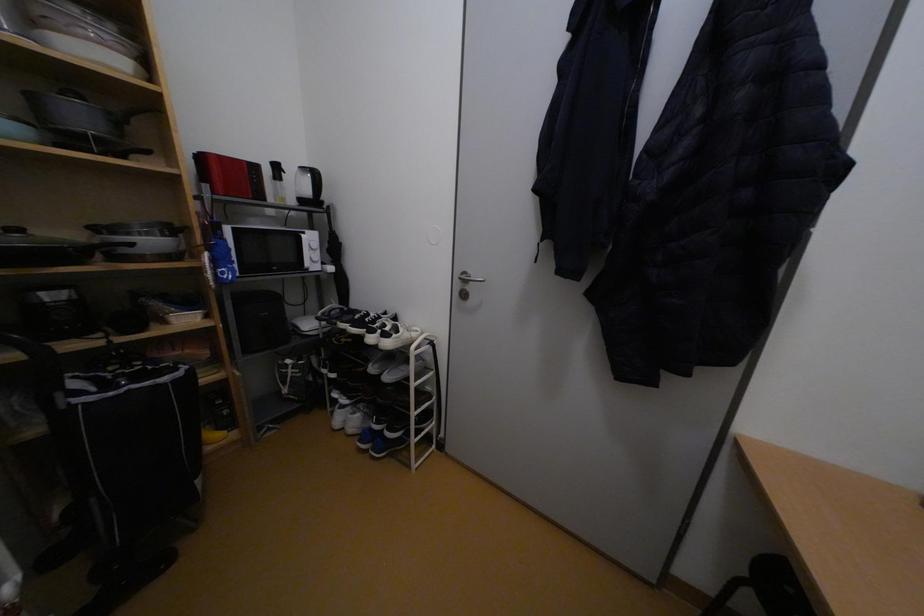
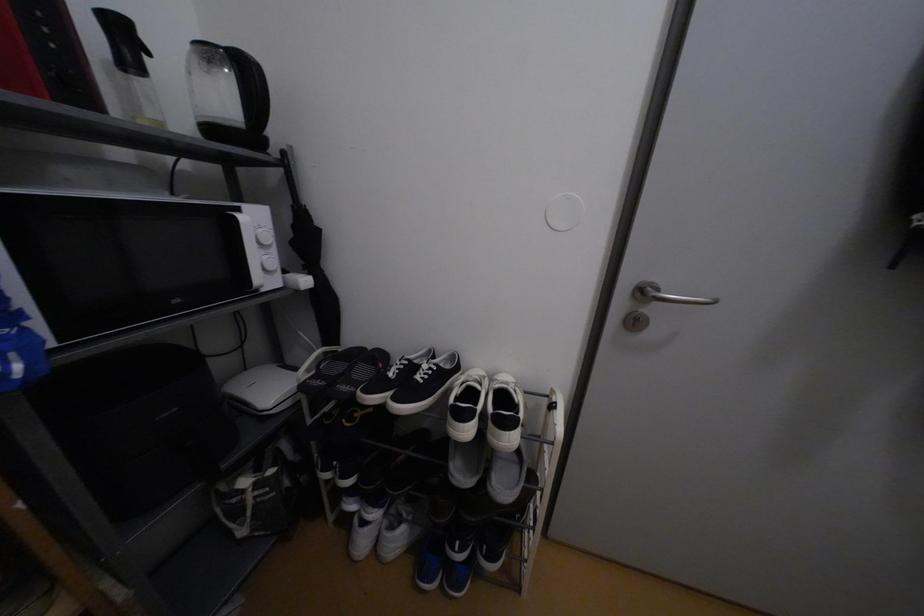
The images are taken continuously from a first-person perspective. In which direction are you moving?

The movement direction of the cameraman is left, forward.